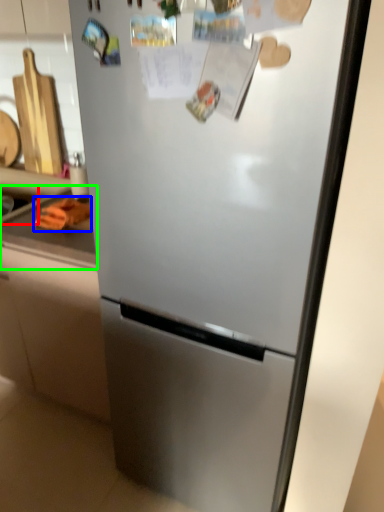
Question: Estimate the real-world distances between objects in this image. Which object is farther from sink (highlighted by a red box), food (highlighted by a blue box) or counter top (highlighted by a green box)?

Choices:
 (A) food
 (B) counter top

Answer: (B)